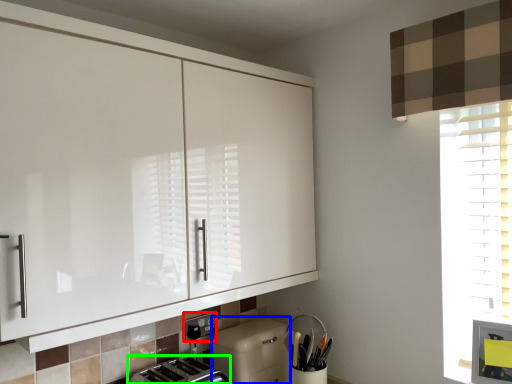
Question: Based on their relative distances, which object is nearer to electric outlet (highlighted by a red box)? Choose from dish washer (highlighted by a blue box) and toaster (highlighted by a green box).

Choices:
 (A) dish washer
 (B) toaster

Answer: (B)